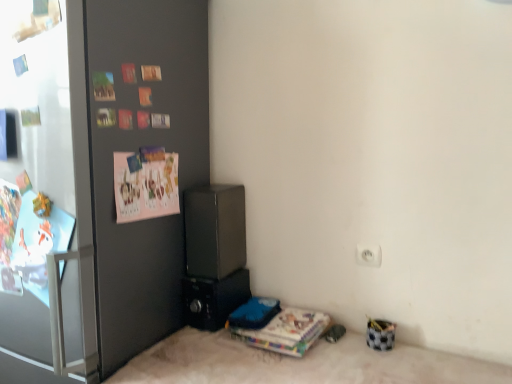
The height and width of the screenshot is (384, 512). Describe the element at coordinates (214, 299) in the screenshot. I see `black plastic speaker at lower center, positioned as the 1th appliance in bottom-to-top order` at that location.

The image size is (512, 384). In order to click on multicolored paper stack at lower center in this screenshot , I will do `click(286, 331)`.

Find the location of `black plastic speaker at lower center, positioned as the 1th appliance in bottom-to-top order`. black plastic speaker at lower center, positioned as the 1th appliance in bottom-to-top order is located at coordinates (214, 299).

From a real-world perspective, is pink paper postcard at upper left positioned above or below satin black speaker at center, the first appliance positioned from the top?

A: In terms of real-world spatial position, pink paper postcard at upper left is above satin black speaker at center, the first appliance positioned from the top.

Which of these two, pink paper postcard at upper left or satin black speaker at center, marked as the second appliance in a bottom-to-top arrangement, is thinner?

Thinner between the two is pink paper postcard at upper left.

Considering the positions of objects pink paper postcard at upper left and satin black speaker at center, the first appliance positioned from the top, in the image provided, who is behind, pink paper postcard at upper left or satin black speaker at center, the first appliance positioned from the top,?

satin black speaker at center, the first appliance positioned from the top, is more distant.

How much distance is there between black plastic speaker at lower center, which is the 2th appliance in top-to-bottom order, and transparent glass door at left?

black plastic speaker at lower center, which is the 2th appliance in top-to-bottom order, and transparent glass door at left are 22.48 inches apart.

Which of these two, black plastic speaker at lower center, positioned as the 1th appliance in bottom-to-top order, or transparent glass door at left, is bigger?

With larger size is transparent glass door at left.

Between black plastic speaker at lower center, which is the 2th appliance in top-to-bottom order, and transparent glass door at left, which one is positioned in front?

transparent glass door at left.

Image resolution: width=512 pixels, height=384 pixels. I want to click on glass door lying above the black plastic speaker at lower center, which is the 2th appliance in top-to-bottom order (from the image's perspective), so click(x=45, y=197).

How many degrees apart are the facing directions of multicolored paper stack at lower center and satin black speaker at center, the first appliance positioned from the top?

multicolored paper stack at lower center and satin black speaker at center, the first appliance positioned from the top, are facing 0.0002 degrees away from each other.

Is the surface of multicolored paper stack at lower center in direct contact with satin black speaker at center, the first appliance positioned from the top?

multicolored paper stack at lower center and satin black speaker at center, the first appliance positioned from the top, are clearly separated.

From a real-world perspective, which object stands above the other?

From a 3D spatial view, satin black speaker at center, the first appliance positioned from the top, is above.

From the image's perspective, which one is positioned higher, multicolored paper stack at lower center or satin black speaker at center, marked as the second appliance in a bottom-to-top arrangement?

From the image's view, satin black speaker at center, marked as the second appliance in a bottom-to-top arrangement, is above.

Which is behind, point (267, 325) or point (64, 242)?

The point (267, 325) is behind.

Considering the positions of objects multicolored paper stack at lower center and transparent glass door at left in the image provided, who is more to the left, multicolored paper stack at lower center or transparent glass door at left?

transparent glass door at left.

From a real-world perspective, between multicolored paper stack at lower center and transparent glass door at left, who is vertically higher?

In real-world perspective, transparent glass door at left is above.

Is multicolored paper stack at lower center shorter than transparent glass door at left?

Yes, multicolored paper stack at lower center is shorter than transparent glass door at left.

Between transparent glass door at left and satin black speaker at center, marked as the second appliance in a bottom-to-top arrangement, which one appears on the right side from the viewer's perspective?

Positioned to the right is satin black speaker at center, marked as the second appliance in a bottom-to-top arrangement.

Consider the image. Which object is further away from the camera, transparent glass door at left or satin black speaker at center, the first appliance positioned from the top?

satin black speaker at center, the first appliance positioned from the top, is more distant.

Is transparent glass door at left smaller than satin black speaker at center, marked as the second appliance in a bottom-to-top arrangement?

Correct, transparent glass door at left occupies less space than satin black speaker at center, marked as the second appliance in a bottom-to-top arrangement.

Would you say transparent glass door at left is inside or outside satin black speaker at center, marked as the second appliance in a bottom-to-top arrangement?

transparent glass door at left is outside satin black speaker at center, marked as the second appliance in a bottom-to-top arrangement.

Is white glossy refrigerator at left shorter than transparent glass door at left?

No, white glossy refrigerator at left is not shorter than transparent glass door at left.

Could you tell me if white glossy refrigerator at left is facing transparent glass door at left?

Yes, white glossy refrigerator at left faces towards transparent glass door at left.

Between white glossy refrigerator at left and transparent glass door at left, which one has larger width?

With larger width is white glossy refrigerator at left.

Is white glossy refrigerator at left beside transparent glass door at left?

white glossy refrigerator at left and transparent glass door at left are clearly separated.

Looking at this image, is pink paper postcard at upper left turned away from white glossy refrigerator at left?

Yes, pink paper postcard at upper left's orientation is away from white glossy refrigerator at left.

Based on the photo, based on their positions, is pink paper postcard at upper left located to the left or right of white glossy refrigerator at left?

pink paper postcard at upper left is to the right of white glossy refrigerator at left.

Can you confirm if pink paper postcard at upper left is bigger than white glossy refrigerator at left?

Actually, pink paper postcard at upper left might be smaller than white glossy refrigerator at left.

Which is correct: pink paper postcard at upper left is inside white glossy refrigerator at left, or outside of it?

pink paper postcard at upper left fits inside white glossy refrigerator at left.

The width and height of the screenshot is (512, 384). I want to click on postcard located above the satin black speaker at center, marked as the second appliance in a bottom-to-top arrangement (from the image's perspective), so click(x=145, y=186).

Find the location of a particular element. glass door lying on the left of black plastic speaker at lower center, which is the 2th appliance in top-to-bottom order is located at coordinates (45, 197).

Looking at the image, which one is located further to transparent glass door at left, pink paper postcard at upper left or multicolored paper stack at lower center?

Among the two, multicolored paper stack at lower center is located further to transparent glass door at left.

When comparing their distances from white glossy refrigerator at left, does multicolored paper stack at lower center or transparent glass door at left seem further?

multicolored paper stack at lower center is positioned further to the anchor white glossy refrigerator at left.

Considering their positions, is transparent glass door at left positioned further to satin black speaker at center, marked as the second appliance in a bottom-to-top arrangement, than white glossy refrigerator at left?

The object further to satin black speaker at center, marked as the second appliance in a bottom-to-top arrangement, is transparent glass door at left.

When comparing their distances from pink paper postcard at upper left, does transparent glass door at left or multicolored paper stack at lower center seem further?

Based on the image, multicolored paper stack at lower center appears to be further to pink paper postcard at upper left.

Based on their spatial positions, is multicolored paper stack at lower center or white glossy refrigerator at left closer to transparent glass door at left?

Based on the image, white glossy refrigerator at left appears to be nearer to transparent glass door at left.

When comparing their distances from pink paper postcard at upper left, does transparent glass door at left or satin black speaker at center, marked as the second appliance in a bottom-to-top arrangement, seem further?

transparent glass door at left is positioned further to the anchor pink paper postcard at upper left.

Which object lies further to the anchor point black plastic speaker at lower center, which is the 2th appliance in top-to-bottom order, pink paper postcard at upper left or transparent glass door at left?

Among the two, transparent glass door at left is located further to black plastic speaker at lower center, which is the 2th appliance in top-to-bottom order.

Based on their spatial positions, is transparent glass door at left or black plastic speaker at lower center, positioned as the 1th appliance in bottom-to-top order, further from pink paper postcard at upper left?

black plastic speaker at lower center, positioned as the 1th appliance in bottom-to-top order, lies further to pink paper postcard at upper left than the other object.

This screenshot has width=512, height=384. Identify the location of door between transparent glass door at left and pink paper postcard at upper left. (137, 152).

The image size is (512, 384). I want to click on postcard located between transparent glass door at left and multicolored paper stack at lower center in the left-right direction, so click(145, 186).

The image size is (512, 384). In order to click on door situated between transparent glass door at left and satin black speaker at center, the first appliance positioned from the top, from left to right in this screenshot , I will do `click(137, 152)`.

At what (x,y) coordinates should I click in order to perform the action: click on postcard located between white glossy refrigerator at left and black plastic speaker at lower center, which is the 2th appliance in top-to-bottom order, in the depth direction. Please return your answer as a coordinate pair (x, y). The width and height of the screenshot is (512, 384). Looking at the image, I should click on (145, 186).